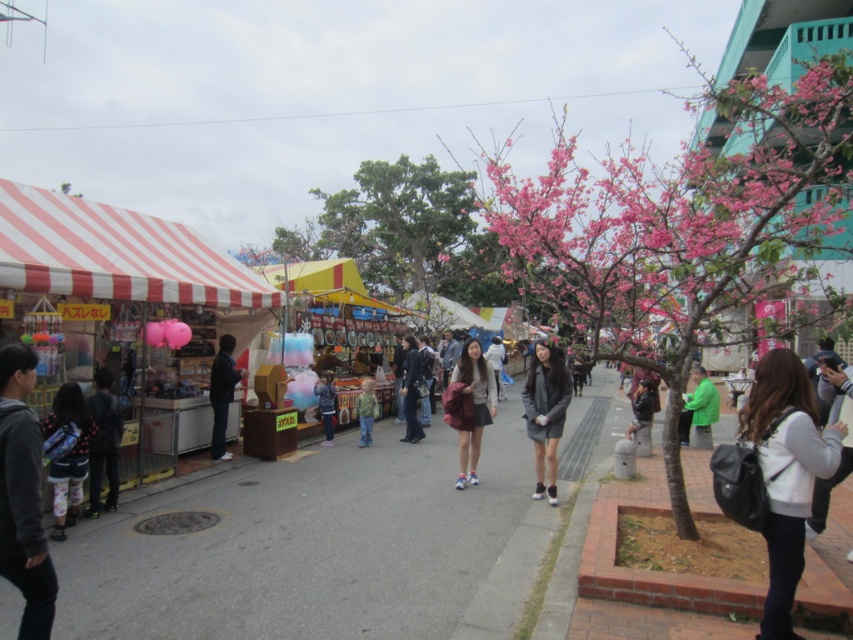
Question: Is matte gray sweater at center in front of dark gray backpack at lower left?

Choices:
 (A) no
 (B) yes

Answer: (A)

Question: Which point is closer to the camera?

Choices:
 (A) (35, 435)
 (B) (55, 486)

Answer: (A)

Question: Is green matte jacket at right above dark gray backpack at lower right?

Choices:
 (A) no
 (B) yes

Answer: (A)

Question: Which of these objects is positioned closest to the denim jacket at center?

Choices:
 (A) green textured shirt at center
 (B) dark gray backpack at lower right

Answer: (A)

Question: Can you confirm if red and white striped canopy at left is positioned below green textured shirt at center?

Choices:
 (A) no
 (B) yes

Answer: (A)

Question: Among these objects, which one is farthest from the camera?

Choices:
 (A) pink blossom tree at upper right
 (B) green matte jacket at right
 (C) gray asphalt at center

Answer: (B)